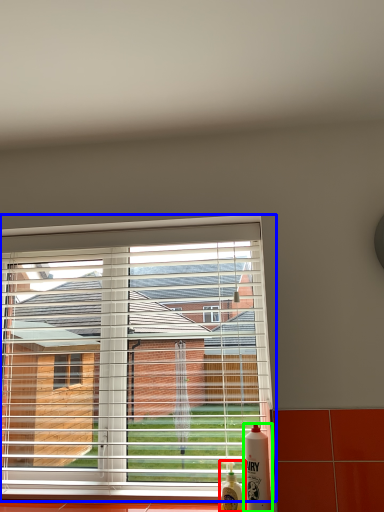
Question: Which object is the closest to the bottle (highlighted by a red box)? Choose among these: window (highlighted by a blue box) or bottle (highlighted by a green box).

Choices:
 (A) window
 (B) bottle

Answer: (B)